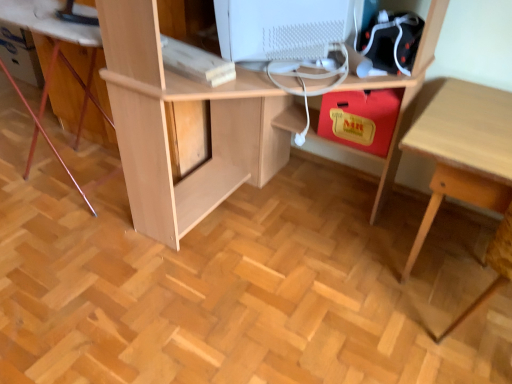
Question: Can you confirm if white matte computer monitor at upper center is shorter than light wood table at lower right?

Choices:
 (A) no
 (B) yes

Answer: (B)

Question: Is white matte computer monitor at upper center wider than light wood table at lower right?

Choices:
 (A) no
 (B) yes

Answer: (A)

Question: From a real-world perspective, is white matte computer monitor at upper center on top of light wood table at lower right?

Choices:
 (A) yes
 (B) no

Answer: (A)

Question: Is white matte computer monitor at upper center touching light wood table at lower right?

Choices:
 (A) yes
 (B) no

Answer: (B)

Question: From the image's perspective, is white matte computer monitor at upper center located above light wood table at lower right?

Choices:
 (A) no
 (B) yes

Answer: (B)

Question: Is white matte computer monitor at upper center behind light wood table at lower right?

Choices:
 (A) no
 (B) yes

Answer: (B)

Question: From a real-world perspective, is white matte computer monitor at upper center on top of light wood desk at center?

Choices:
 (A) yes
 (B) no

Answer: (A)

Question: Are white matte computer monitor at upper center and light wood desk at center far apart?

Choices:
 (A) no
 (B) yes

Answer: (A)

Question: Can you confirm if white matte computer monitor at upper center is thinner than light wood desk at center?

Choices:
 (A) no
 (B) yes

Answer: (B)

Question: Does white matte computer monitor at upper center have a greater height compared to light wood desk at center?

Choices:
 (A) no
 (B) yes

Answer: (A)

Question: Is white matte computer monitor at upper center oriented towards light wood desk at center?

Choices:
 (A) yes
 (B) no

Answer: (A)

Question: Does white matte computer monitor at upper center have a lesser height compared to light wood desk at center?

Choices:
 (A) no
 (B) yes

Answer: (B)

Question: Can you confirm if light wood table at lower right is thinner than white matte computer monitor at upper center?

Choices:
 (A) yes
 (B) no

Answer: (B)